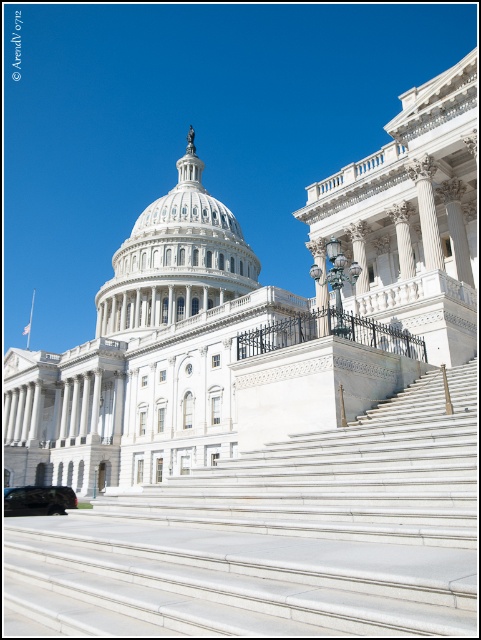
You are a tourist visiting the United States Capitol Building. You notice the white marble dome at center and the shiny black car at lower left in the scene. Which object appears bigger in the image?

The white marble dome at center appears bigger than the shiny black car at lower left in the image.

From the picture: You are standing in front of the United States Capitol Building and see the black wrought iron railing at center and the shiny black car at lower left. Which object is nearer to you?

The black wrought iron railing at center is closer to the viewer than the shiny black car at lower left.